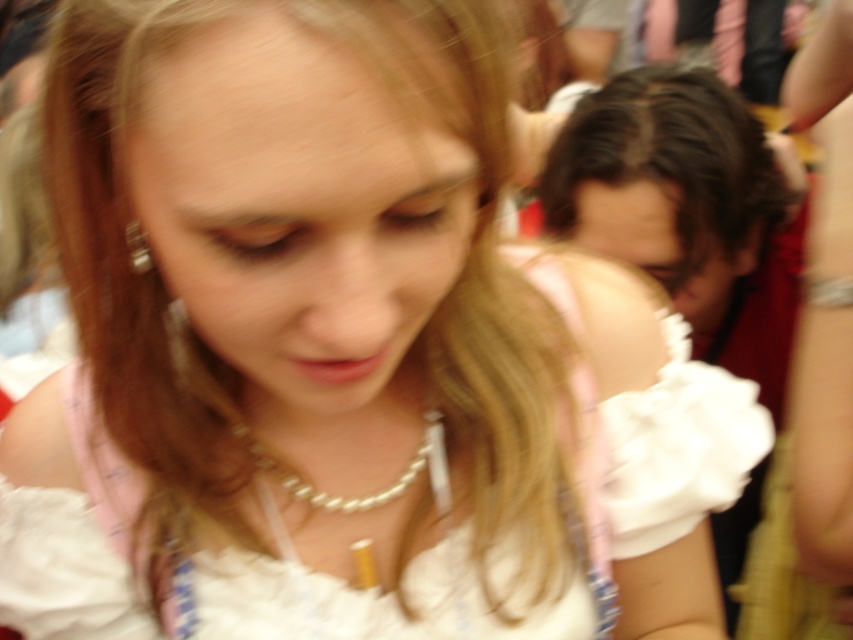
You are a photographer analyzing the image. You notice the dark brown hair at upper right and the pearl necklace at center. Which object occupies more visual space in the image?

The dark brown hair at upper right has a larger size compared to pearl necklace at center, so it occupies more visual space in the image.